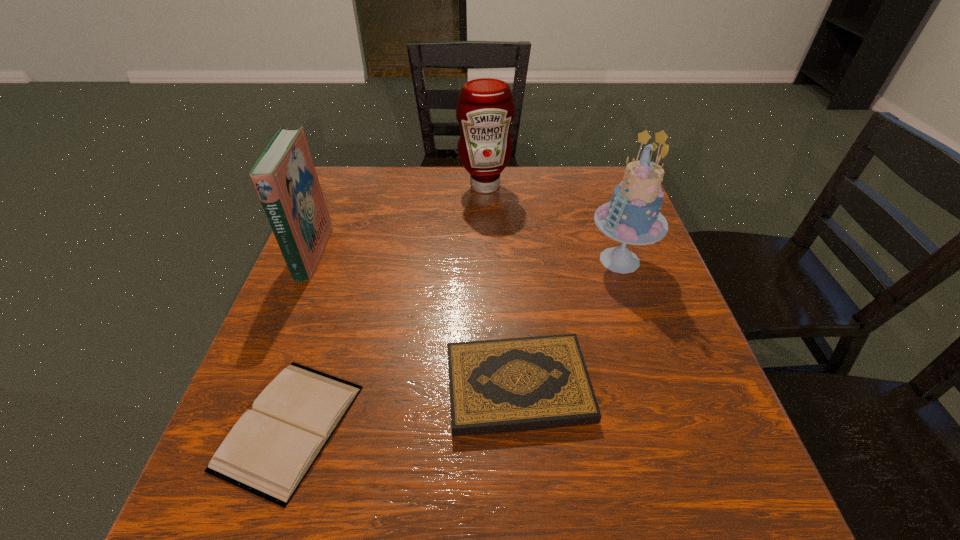
Find the location of a particular element. Image resolution: width=960 pixels, height=540 pixels. vacant space at the far left corner of the desktop is located at coordinates (334, 193).

I want to click on vacant point at the far right corner, so click(594, 175).

What are the coordinates of `free space that is in between the farthest hardback book and the shortest hardback book` in the screenshot? It's located at (301, 340).

Identify the location of vacant space that is in between the rightmost object and the farthest object. This screenshot has height=540, width=960. (552, 223).

Find the location of a particular element. The image size is (960, 540). empty space that is in between the rightmost hardback book and the cake is located at coordinates pyautogui.click(x=569, y=323).

You are a GUI agent. You are given a task and a screenshot of the screen. Output one action in this format:
    pyautogui.click(x=<x>, y=<y>)
    Task: Click on the blank region between the second shortest hardback book and the rightmost object
    The image size is (960, 540).
    Given the screenshot: What is the action you would take?
    pyautogui.click(x=569, y=323)

The height and width of the screenshot is (540, 960). In order to click on free point between the shortest object and the second tallest hardback book in this screenshot , I will do click(x=404, y=407).

You are a GUI agent. You are given a task and a screenshot of the screen. Output one action in this format:
    pyautogui.click(x=<x>, y=<y>)
    Task: Click on the free point between the fourth tallest object and the shortest hardback book
    Image resolution: width=960 pixels, height=540 pixels.
    Given the screenshot: What is the action you would take?
    (x=404, y=407)

Where is `vacant area that lies between the tallest hardback book and the shortest object`? vacant area that lies between the tallest hardback book and the shortest object is located at coordinates (301, 340).

The height and width of the screenshot is (540, 960). I want to click on empty space between the farthest object and the fourth tallest object, so [501, 286].